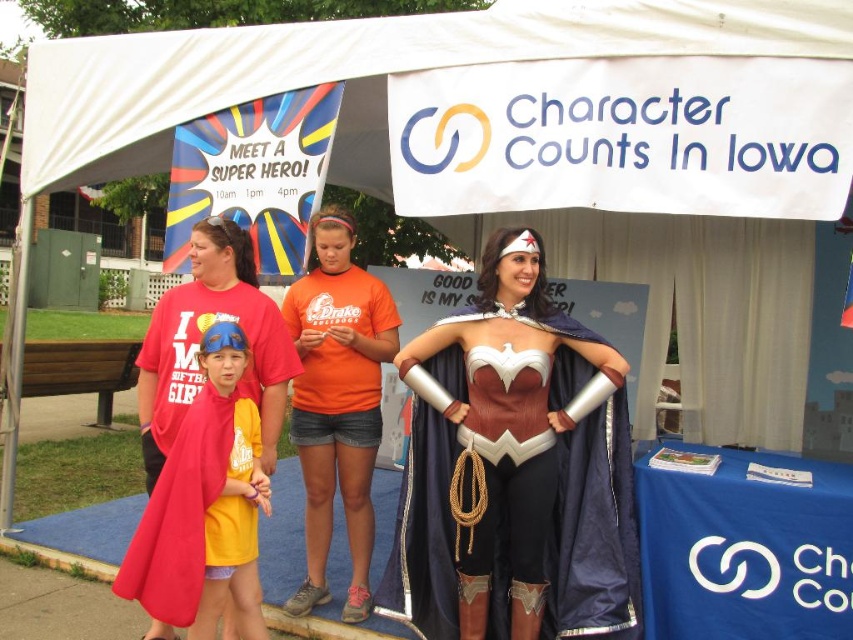
How distant is shiny red cape at center from white fabric canopy at upper center?

shiny red cape at center is 1.65 meters from white fabric canopy at upper center.

Between point (567, 589) and point (511, 3), which one is positioned behind?

The point (511, 3) is more distant.

Based on the photo, measure the distance between shiny red cape at center and camera.

shiny red cape at center is 2.98 meters away from camera.

What are the coordinates of `shiny red cape at center` in the screenshot? It's located at (515, 468).

Does shiny metallic costume at center appear over matte yellow t-shirt at center?

Yes, shiny metallic costume at center is above matte yellow t-shirt at center.

The height and width of the screenshot is (640, 853). What do you see at coordinates (514, 468) in the screenshot?
I see `shiny metallic costume at center` at bounding box center [514, 468].

Image resolution: width=853 pixels, height=640 pixels. What are the coordinates of `shiny metallic costume at center` in the screenshot? It's located at (514, 468).

Does point (540, 460) come closer to viewer compared to point (386, 42)?

Yes, point (540, 460) is in front of point (386, 42).

What are the coordinates of `shiny metallic costume at center` in the screenshot? It's located at (514, 468).

The height and width of the screenshot is (640, 853). I want to click on shiny metallic costume at center, so click(514, 468).